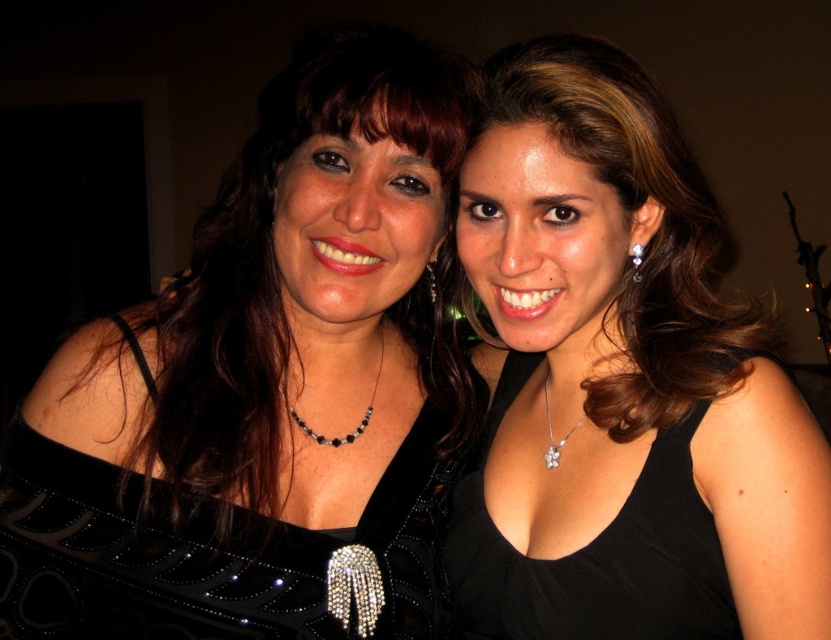
Question: Does black sequined dress at left have a larger size compared to silver metallic earring at center?

Choices:
 (A) no
 (B) yes

Answer: (B)

Question: Which point is closer to the camera?

Choices:
 (A) black satin dress at center
 (B) black sequined dress at left
 (C) black satin dress at right
 (D) black beaded necklace at center

Answer: (A)

Question: Among these objects, which one is farthest from the camera?

Choices:
 (A) black satin dress at right
 (B) black sequined dress at left
 (C) silver metallic earring at center

Answer: (C)

Question: Is shiny black dress at center further to the viewer compared to clear crystal earring at center?

Choices:
 (A) yes
 (B) no

Answer: (B)

Question: Which point appears farthest from the camera in this image?

Choices:
 (A) (642, 244)
 (B) (381, 340)

Answer: (B)

Question: Can you confirm if shiny black dress at center is positioned to the right of clear crystal earring at center?

Choices:
 (A) no
 (B) yes

Answer: (A)